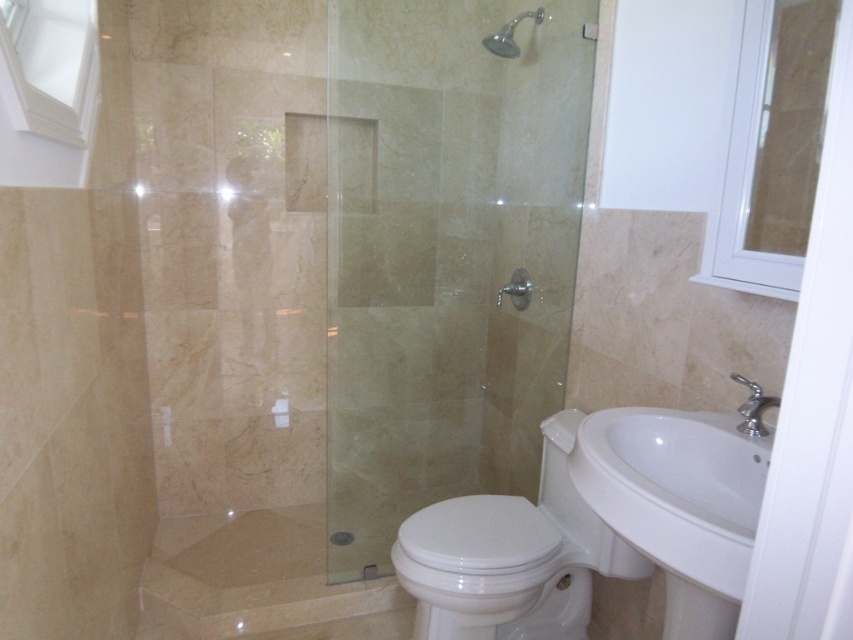
Between white glossy sink at lower right and beige marble shower at lower left, which one is positioned higher?

white glossy sink at lower right is higher up.

Looking at this image, measure the distance between white glossy sink at lower right and beige marble shower at lower left.

white glossy sink at lower right is 1.17 meters away from beige marble shower at lower left.

Image resolution: width=853 pixels, height=640 pixels. I want to click on white glossy sink at lower right, so click(x=680, y=500).

Does point (590, 442) come closer to viewer compared to point (514, 42)?

Yes, point (590, 442) is closer to viewer.

Can you confirm if white glossy sink at lower right is shorter than matte silver showerhead at upper center?

No, white glossy sink at lower right is not shorter than matte silver showerhead at upper center.

Is point (622, 440) positioned after point (502, 52)?

No, it is not.

The width and height of the screenshot is (853, 640). What are the coordinates of `white glossy sink at lower right` in the screenshot? It's located at click(680, 500).

Does point (643, 461) lie in front of point (479, 602)?

Yes, it is.

Is white glossy sink at lower right further to camera compared to white glossy toilet at lower center?

That is False.

Which is behind, point (610, 502) or point (534, 515)?

The point (534, 515) is more distant.

I want to click on white glossy sink at lower right, so (680, 500).